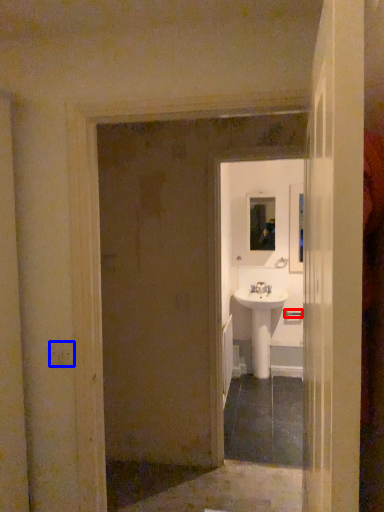
Question: Which object is further to the camera taking this photo, door handle (highlighted by a red box) or light switch (highlighted by a blue box)?

Choices:
 (A) door handle
 (B) light switch

Answer: (A)